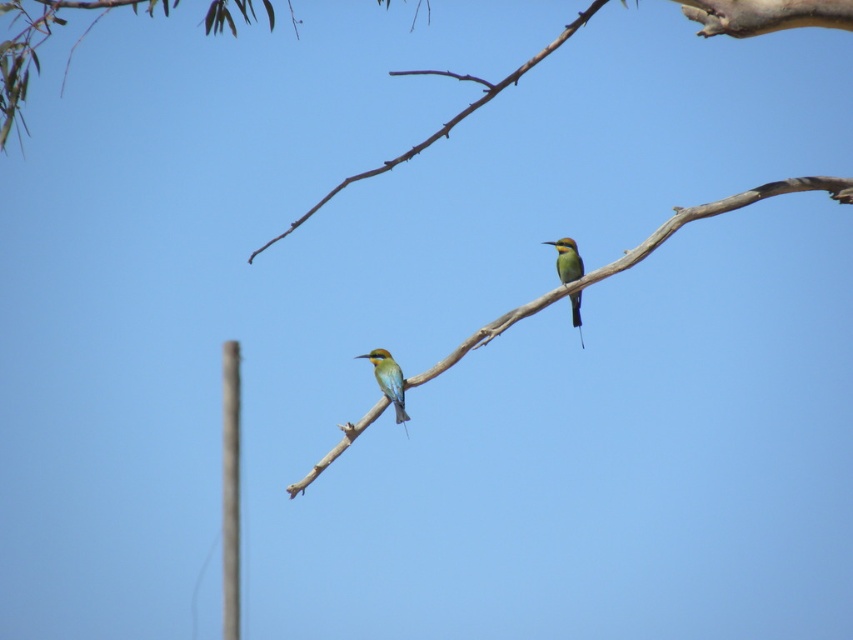
Question: In this image, where is smooth wood branch at center located relative to gray concrete pole at left?

Choices:
 (A) right
 (B) left

Answer: (A)

Question: Which of the following is the closest to the observer?

Choices:
 (A) smooth wood branch at center
 (B) gray concrete pole at left

Answer: (A)

Question: Is the position of smooth wood branch at center less distant than that of green glossy bee-eater at center?

Choices:
 (A) no
 (B) yes

Answer: (B)

Question: Is gray concrete pole at left positioned at the back of green iridescent parrot at center?

Choices:
 (A) no
 (B) yes

Answer: (B)

Question: Which point is farther from the camera taking this photo?

Choices:
 (A) (229, 465)
 (B) (379, 387)
 (C) (312, 477)

Answer: (A)

Question: Among these objects, which one is farthest from the camera?

Choices:
 (A) green iridescent parrot at center
 (B) smooth wood branch at center
 (C) green glossy bee-eater at center
 (D) gray concrete pole at left

Answer: (D)